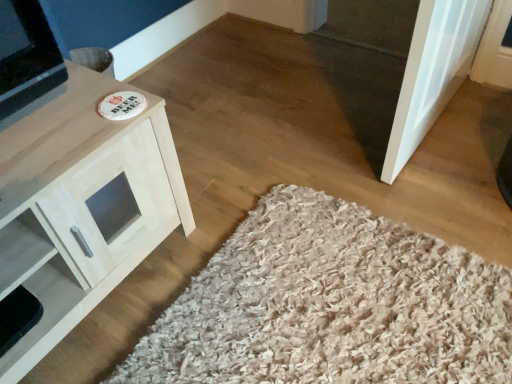
Locate an element on the screen. The width and height of the screenshot is (512, 384). free spot above light wood cabinet at left (from a real-world perspective) is located at coordinates point(51,127).